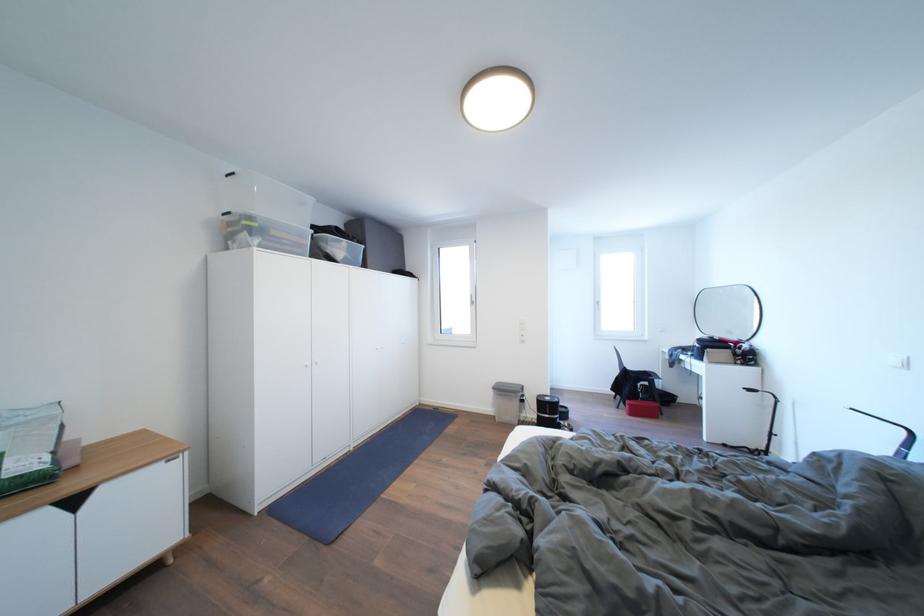
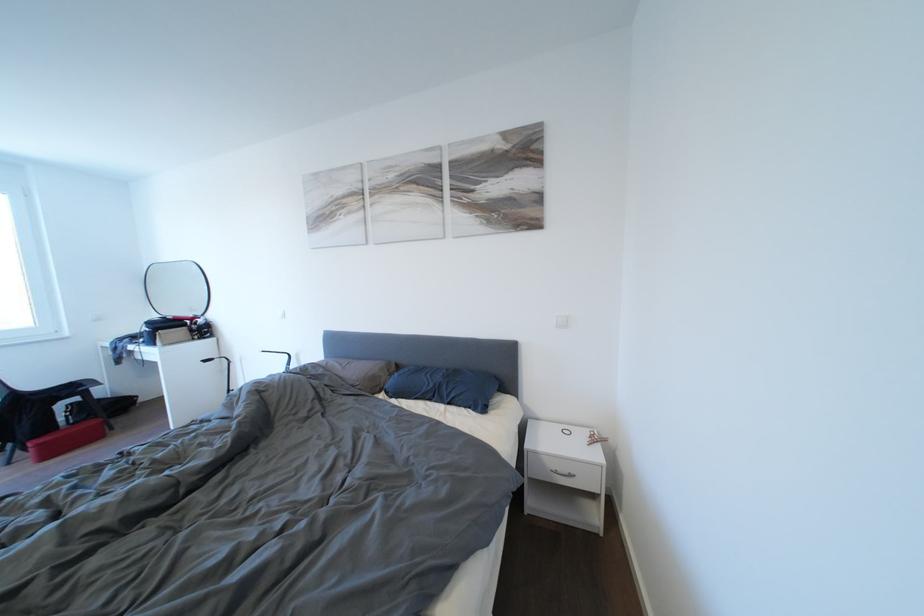
Question: The camera is either moving clockwise (left) or counter-clockwise (right) around the object. The first image is from the beginning of the video and the second image is from the end. Is the camera moving left or right when shooting the video?

Choices:
 (A) Left
 (B) Right

Answer: (A)